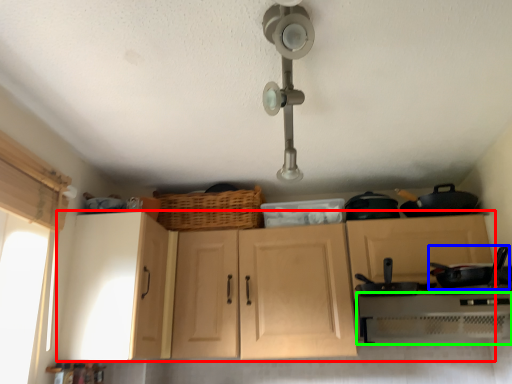
Question: Based on their relative distances, which object is farther from cabinetry (highlighted by a red box)? Choose from frying pan (highlighted by a blue box) and oven (highlighted by a green box).

Choices:
 (A) frying pan
 (B) oven

Answer: (A)